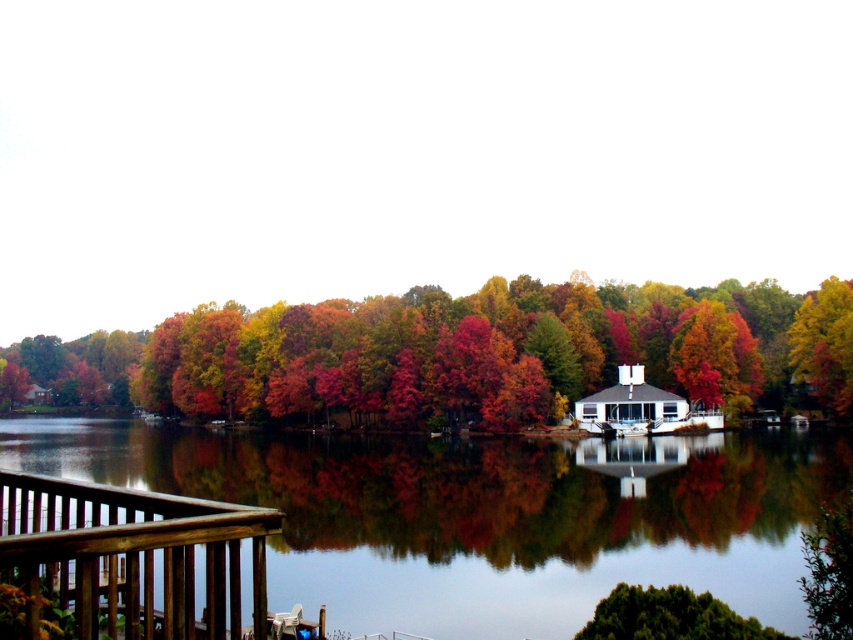
In the scene shown: Can you confirm if smooth reflective water at center is shorter than brown wooden railing at lower left?

In fact, smooth reflective water at center may be taller than brown wooden railing at lower left.

From the picture: Is smooth reflective water at center bigger than brown wooden railing at lower left?

Yes.

Locate an element on the screen. smooth reflective water at center is located at coordinates (485, 515).

Looking at this image, is autumn leaves at center positioned in front of brown wooden railing at lower left?

That is False.

Does autumn leaves at center appear on the left side of brown wooden railing at lower left?

Indeed, autumn leaves at center is positioned on the left side of brown wooden railing at lower left.

Is point (711, 323) more distant than point (88, 577)?

Yes, point (711, 323) is behind point (88, 577).

Locate an element on the screen. autumn leaves at center is located at coordinates (463, 353).

What are the coordinates of `smooth reflective water at center` in the screenshot? It's located at (485, 515).

Is smooth reflective water at center taller than autumn leaves at center?

No, smooth reflective water at center is not taller than autumn leaves at center.

Does point (686, 544) lie in front of point (54, 369)?

Yes.

In order to click on smooth reflective water at center in this screenshot , I will do `click(485, 515)`.